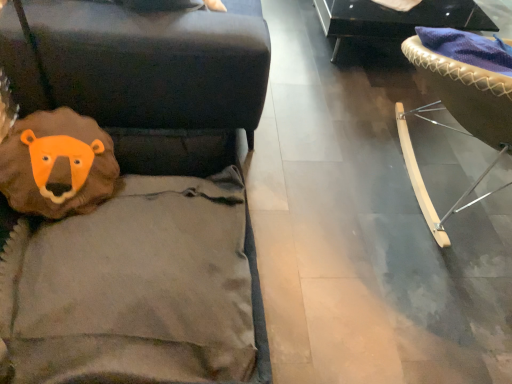
Question: Considering the relative positions of shiny black coffee table at upper right, which ranks as the second furniture in front-to-back order, and light brown leather chair at right, acting as the 2th furniture starting from the back, in the image provided, is shiny black coffee table at upper right, which ranks as the second furniture in front-to-back order, to the right of light brown leather chair at right, acting as the 2th furniture starting from the back, from the viewer's perspective?

Choices:
 (A) no
 (B) yes

Answer: (A)

Question: Does shiny black coffee table at upper right, which ranks as the second furniture in front-to-back order, lie behind light brown leather chair at right, acting as the 2th furniture starting from the back?

Choices:
 (A) no
 (B) yes

Answer: (B)

Question: Are shiny black coffee table at upper right, which is counted as the first furniture, starting from the top, and light brown leather chair at right, acting as the 2th furniture starting from the back, far apart?

Choices:
 (A) no
 (B) yes

Answer: (B)

Question: Does shiny black coffee table at upper right, which is counted as the first furniture, starting from the top, have a smaller size compared to light brown leather chair at right, the 2th furniture from the top?

Choices:
 (A) no
 (B) yes

Answer: (B)

Question: Is shiny black coffee table at upper right, the second furniture in the bottom-to-top sequence, wider than light brown leather chair at right, positioned as the first furniture in front-to-back order?

Choices:
 (A) no
 (B) yes

Answer: (A)

Question: From the image's perspective, would you say shiny black coffee table at upper right, the second furniture in the bottom-to-top sequence, is shown under light brown leather chair at right, positioned as the first furniture in front-to-back order?

Choices:
 (A) no
 (B) yes

Answer: (A)

Question: Is there a large distance between light brown leather chair at right, the 2th furniture from the top, and shiny black coffee table at upper right, which ranks as the second furniture in front-to-back order?

Choices:
 (A) yes
 (B) no

Answer: (A)

Question: Does light brown leather chair at right, acting as the 2th furniture starting from the back, come behind shiny black coffee table at upper right, which ranks as the second furniture in front-to-back order?

Choices:
 (A) yes
 (B) no

Answer: (B)

Question: Is shiny black coffee table at upper right, the second furniture in the bottom-to-top sequence, a part of light brown leather chair at right, the 2th furniture from the top?

Choices:
 (A) no
 (B) yes

Answer: (A)

Question: Does light brown leather chair at right, the 2th furniture from the top, have a greater width compared to shiny black coffee table at upper right, which ranks as the 1th furniture in back-to-front order?

Choices:
 (A) no
 (B) yes

Answer: (B)

Question: From the image's perspective, is light brown leather chair at right, acting as the 1th furniture starting from the bottom, on shiny black coffee table at upper right, the second furniture in the bottom-to-top sequence?

Choices:
 (A) yes
 (B) no

Answer: (B)

Question: Considering the relative sizes of light brown leather chair at right, positioned as the first furniture in front-to-back order, and shiny black coffee table at upper right, which ranks as the second furniture in front-to-back order, in the image provided, is light brown leather chair at right, positioned as the first furniture in front-to-back order, taller than shiny black coffee table at upper right, which ranks as the second furniture in front-to-back order,?

Choices:
 (A) no
 (B) yes

Answer: (B)

Question: Is light brown leather chair at right, positioned as the first furniture in front-to-back order, in front of or behind shiny black coffee table at upper right, which ranks as the 1th furniture in back-to-front order, in the image?

Choices:
 (A) front
 (B) behind

Answer: (A)